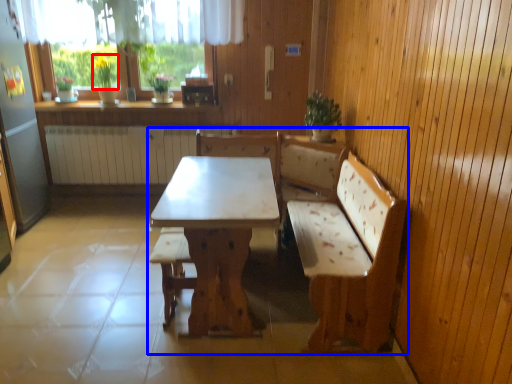
Question: Which point is closer to the camera, plant (highlighted by a red box) or furniture (highlighted by a blue box)?

Choices:
 (A) plant
 (B) furniture

Answer: (B)